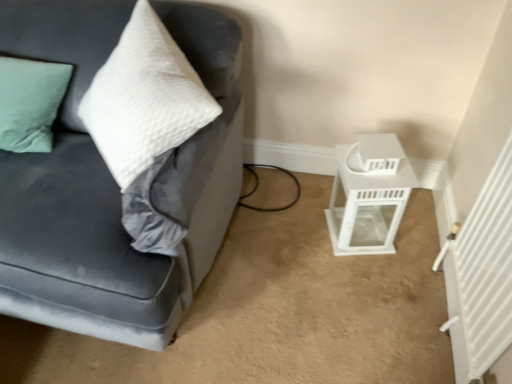
Question: Are white glossy lantern at lower right and velvet gray couch at left making contact?

Choices:
 (A) yes
 (B) no

Answer: (B)

Question: Can you confirm if white glossy lantern at lower right is wider than velvet gray couch at left?

Choices:
 (A) no
 (B) yes

Answer: (A)

Question: Would you say white glossy lantern at lower right contains velvet gray couch at left?

Choices:
 (A) yes
 (B) no

Answer: (B)

Question: From the image's perspective, is white glossy lantern at lower right located above velvet gray couch at left?

Choices:
 (A) no
 (B) yes

Answer: (A)

Question: Does white glossy lantern at lower right come in front of velvet gray couch at left?

Choices:
 (A) no
 (B) yes

Answer: (A)

Question: Considering the relative positions of white glossy lantern at lower right and velvet gray couch at left in the image provided, is white glossy lantern at lower right to the left of velvet gray couch at left from the viewer's perspective?

Choices:
 (A) yes
 (B) no

Answer: (B)

Question: Can you confirm if velvet gray couch at left is bigger than white glossy lantern at lower right?

Choices:
 (A) no
 (B) yes

Answer: (B)

Question: Can we say velvet gray couch at left lies outside white glossy lantern at lower right?

Choices:
 (A) no
 (B) yes

Answer: (B)

Question: Considering the relative positions of velvet gray couch at left and white glossy lantern at lower right in the image provided, is velvet gray couch at left to the right of white glossy lantern at lower right from the viewer's perspective?

Choices:
 (A) yes
 (B) no

Answer: (B)

Question: Does velvet gray couch at left have a lesser height compared to white glossy lantern at lower right?

Choices:
 (A) no
 (B) yes

Answer: (A)

Question: Can you confirm if velvet gray couch at left is taller than white glossy lantern at lower right?

Choices:
 (A) yes
 (B) no

Answer: (A)

Question: Is velvet gray couch at left further to camera compared to white glossy lantern at lower right?

Choices:
 (A) no
 (B) yes

Answer: (A)

Question: Considering the positions of velvet gray couch at left and white glossy lantern at lower right in the image, is velvet gray couch at left wider or thinner than white glossy lantern at lower right?

Choices:
 (A) thin
 (B) wide

Answer: (B)